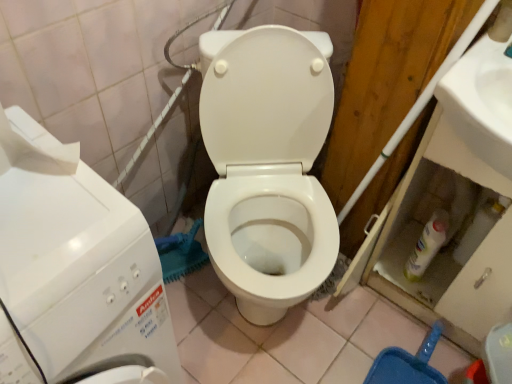
Question: Can you confirm if white glossy toilet at center is taller than white glossy washing machine at left?

Choices:
 (A) no
 (B) yes

Answer: (B)

Question: From a real-world perspective, is white glossy toilet at center on top of white glossy washing machine at left?

Choices:
 (A) yes
 (B) no

Answer: (B)

Question: Is the depth of white glossy toilet at center less than that of white glossy washing machine at left?

Choices:
 (A) no
 (B) yes

Answer: (A)

Question: Is white glossy toilet at center at the left side of white glossy washing machine at left?

Choices:
 (A) no
 (B) yes

Answer: (A)

Question: Does white glossy toilet at center have a lesser height compared to white glossy washing machine at left?

Choices:
 (A) yes
 (B) no

Answer: (B)

Question: Is point (58, 152) positioned closer to the camera than point (250, 153)?

Choices:
 (A) closer
 (B) farther

Answer: (A)

Question: In the image, is white glossy washing machine at left positioned in front of or behind white glossy toilet at center?

Choices:
 (A) front
 (B) behind

Answer: (A)

Question: Which is correct: white glossy washing machine at left is inside white glossy toilet at center, or outside of it?

Choices:
 (A) outside
 (B) inside

Answer: (A)

Question: From their relative heights in the image, would you say white glossy washing machine at left is taller or shorter than white glossy toilet at center?

Choices:
 (A) short
 (B) tall

Answer: (A)

Question: From a real-world perspective, is white glossy washing machine at left positioned above or below white glossy sink at upper right?

Choices:
 (A) below
 (B) above

Answer: (A)

Question: Visually, is white glossy washing machine at left positioned to the left or to the right of white glossy sink at upper right?

Choices:
 (A) right
 (B) left

Answer: (B)

Question: Considering their positions, is white glossy washing machine at left located in front of or behind white glossy sink at upper right?

Choices:
 (A) front
 (B) behind

Answer: (A)

Question: Considering the positions of white glossy washing machine at left and white glossy sink at upper right in the image, is white glossy washing machine at left taller or shorter than white glossy sink at upper right?

Choices:
 (A) short
 (B) tall

Answer: (B)

Question: Is white glossy toilet at center inside or outside of white glossy sink at upper right?

Choices:
 (A) outside
 (B) inside

Answer: (A)

Question: From the image's perspective, relative to white glossy sink at upper right, is white glossy toilet at center above or below?

Choices:
 (A) above
 (B) below

Answer: (B)